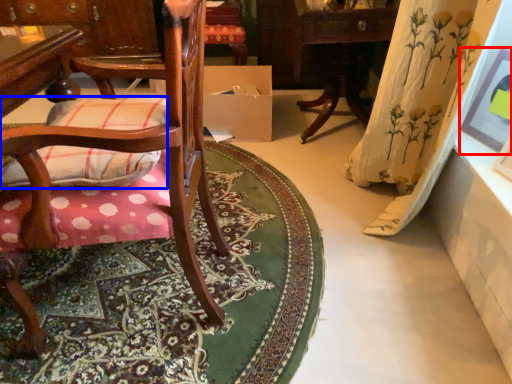
Question: Which of the following is the closest to the observer, picture frame (highlighted by a red box) or throw pillow (highlighted by a blue box)?

Choices:
 (A) picture frame
 (B) throw pillow

Answer: (B)